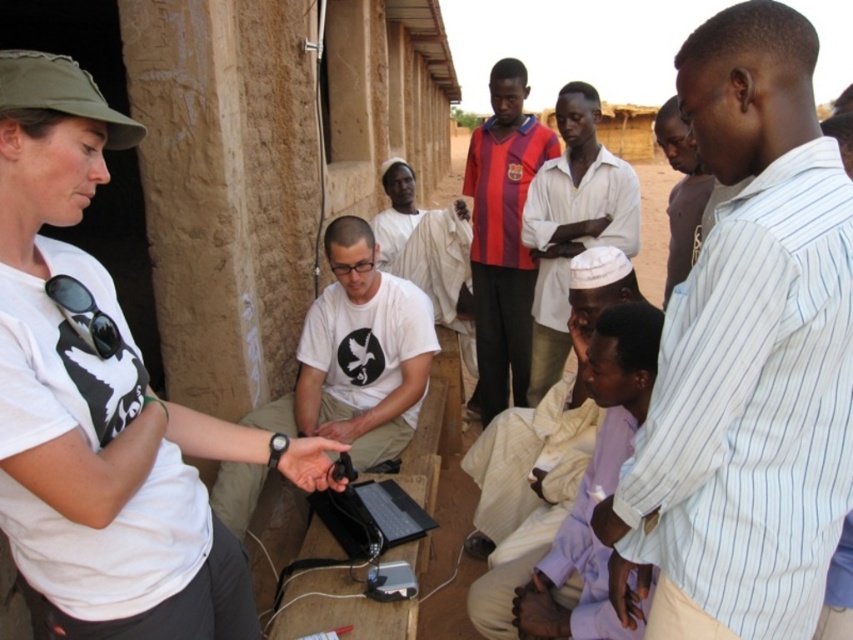
In the scene shown: You are standing at point (706, 56) and want to move to the laptop on the wooden table. The distance between you and the laptop is 2.03 meters. Can you reach it without moving more than 2 meters?

The distance between you and the laptop is 2.03 meters, which is slightly more than 2 meters, so you cannot reach it without moving more than 2 meters.

In the scene described, there are two shirts visible. The white striped shirt at center and the purple cotton shirt at lower center. From the perspective of someone standing in front of the scene, which shirt is positioned to the right of the other?

The white striped shirt at center is positioned to the right of the purple cotton shirt at lower center.

You are a photographer trying to capture a clear shot of both the white striped shirt at center and the black plastic laptop at center. Since you want to focus on the laptop, should you adjust your camera to focus on something closer or farther than the laptop?

The white striped shirt at center is taller than the black plastic laptop at center, so the shirt is farther away. To focus on the laptop, adjust your camera to focus on something closer than the laptop.